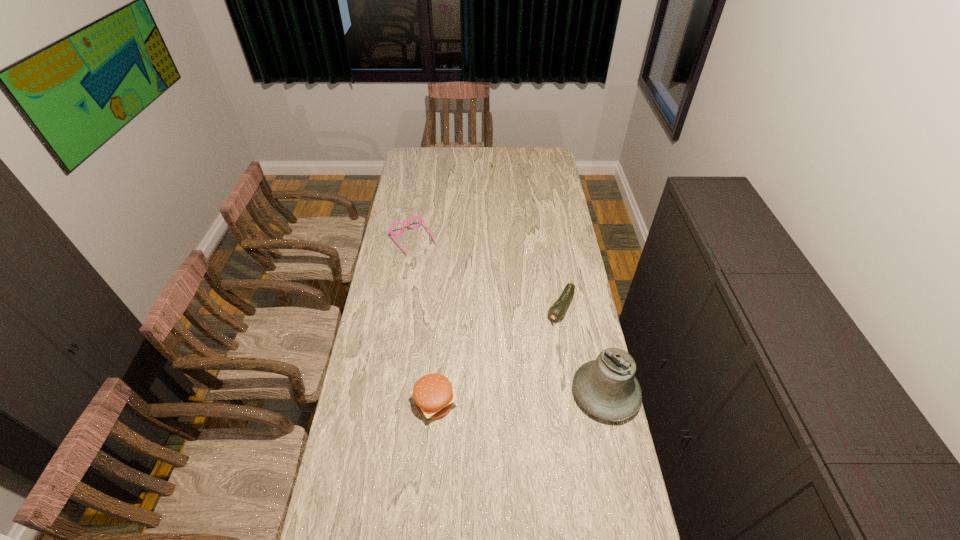
What are the coordinates of `free space on the desktop that is between the third shortest object and the tallest object and is positioned on the arms of the spectacles` in the screenshot? It's located at (530, 397).

Locate an element on the screen. free spot on the desktop that is between the hamburger and the bell and is positioned at the blossom end of the third nearest object is located at coordinates (498, 399).